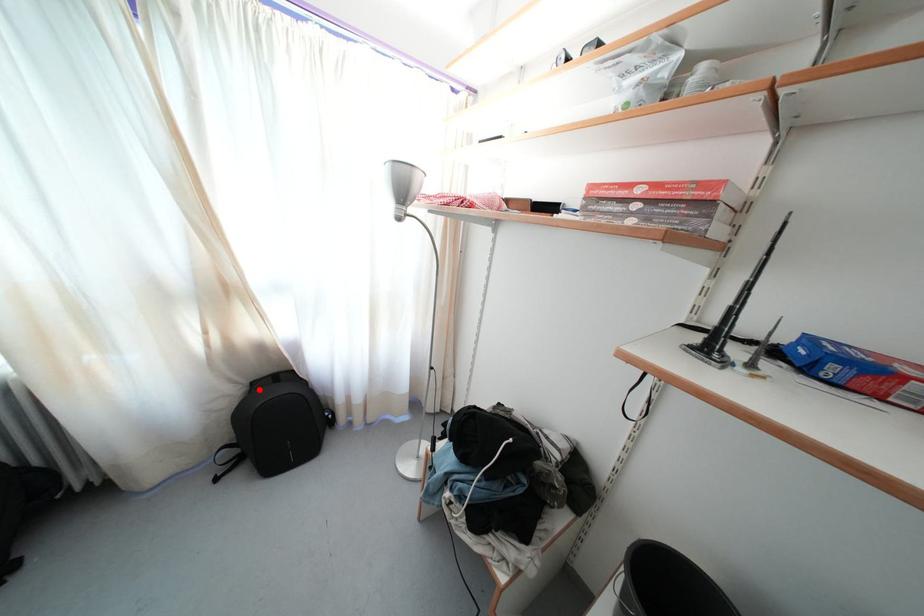
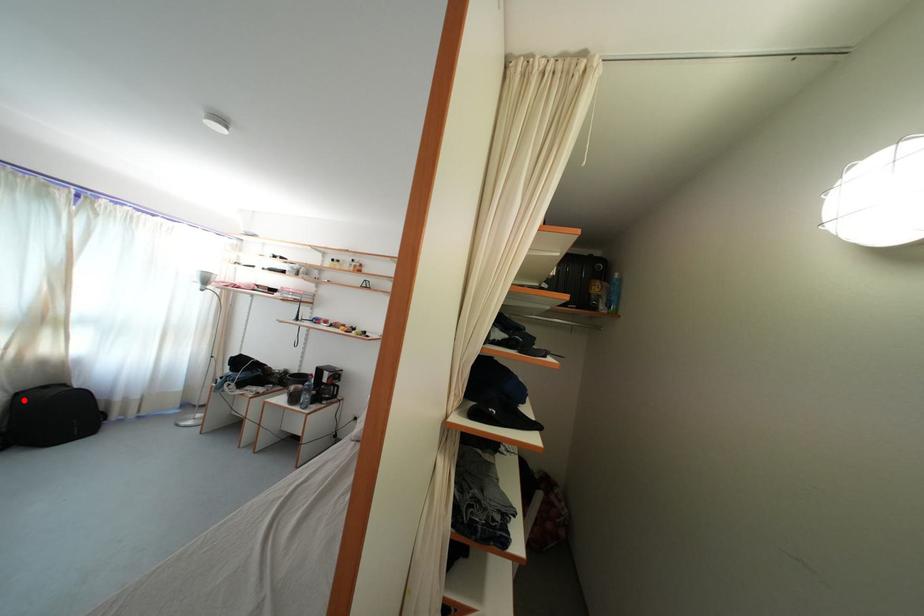
Consider the image. I am providing you with two images of the same scene from different viewpoints. A red point is marked on the first image and another point is marked on the second image. Is the marked point in image1 the same physical position as the marked point in image2?

Yes